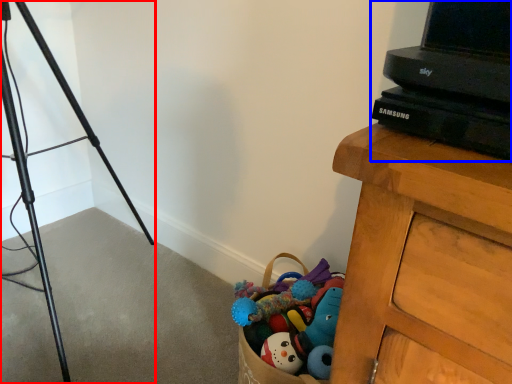
Question: Among these objects, which one is nearest to the camera, tripod (highlighted by a red box) or computer (highlighted by a blue box)?

Choices:
 (A) tripod
 (B) computer

Answer: (B)